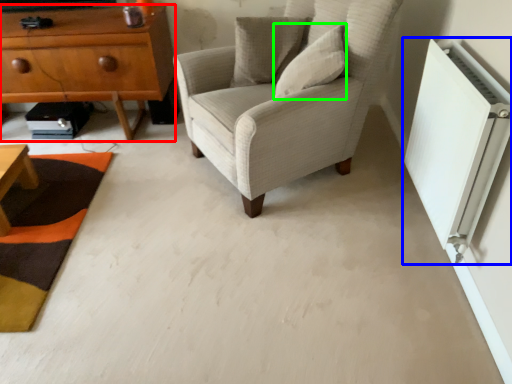
Question: Which object is the farthest from chest of drawers (highlighted by a red box)? Choose among these: air conditioning (highlighted by a blue box) or pillow (highlighted by a green box).

Choices:
 (A) air conditioning
 (B) pillow

Answer: (A)